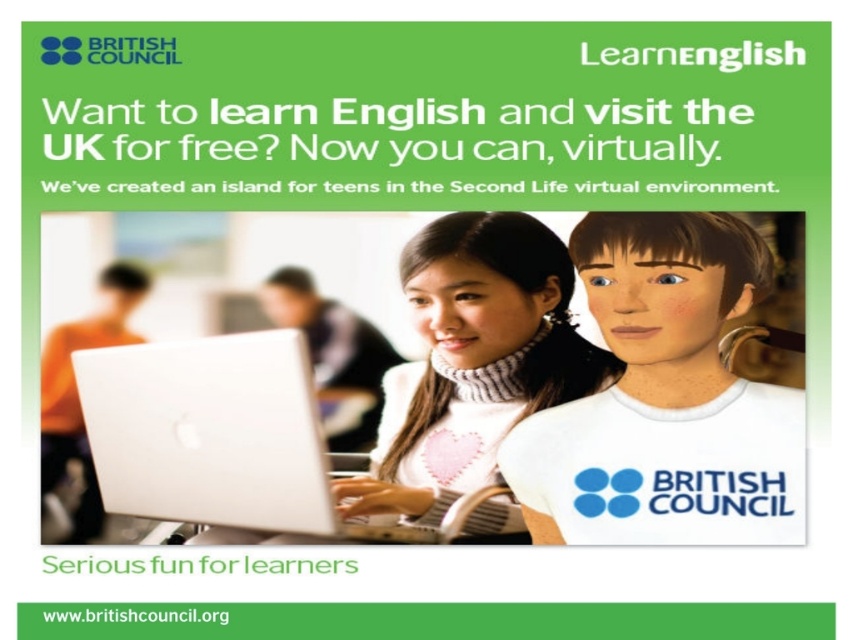
Is white matte t-shirt at center to the left of white matte laptop at center from the viewer's perspective?

Incorrect, white matte t-shirt at center is not on the left side of white matte laptop at center.

Looking at this image, is white matte t-shirt at center shorter than white matte laptop at center?

Incorrect, white matte t-shirt at center's height does not fall short of white matte laptop at center's.

Describe the element at coordinates (665, 397) in the screenshot. I see `white matte t-shirt at center` at that location.

Identify the location of white matte t-shirt at center. The image size is (853, 640). (665, 397).

Does white matte t-shirt at center have a larger size compared to white knitted sweater at center?

No, white matte t-shirt at center is not bigger than white knitted sweater at center.

Which is more to the left, white matte t-shirt at center or white knitted sweater at center?

From the viewer's perspective, white knitted sweater at center appears more on the left side.

Is point (546, 468) positioned behind point (595, 388)?

No, (546, 468) is in front of (595, 388).

Locate an element on the screen. This screenshot has height=640, width=853. white matte t-shirt at center is located at coordinates (665, 397).

Is white matte laptop at center bigger than white knitted sweater at center?

No, white matte laptop at center is not bigger than white knitted sweater at center.

Does white matte laptop at center appear on the right side of white knitted sweater at center?

In fact, white matte laptop at center is to the left of white knitted sweater at center.

Where is `white matte laptop at center`? The width and height of the screenshot is (853, 640). white matte laptop at center is located at coordinates (236, 442).